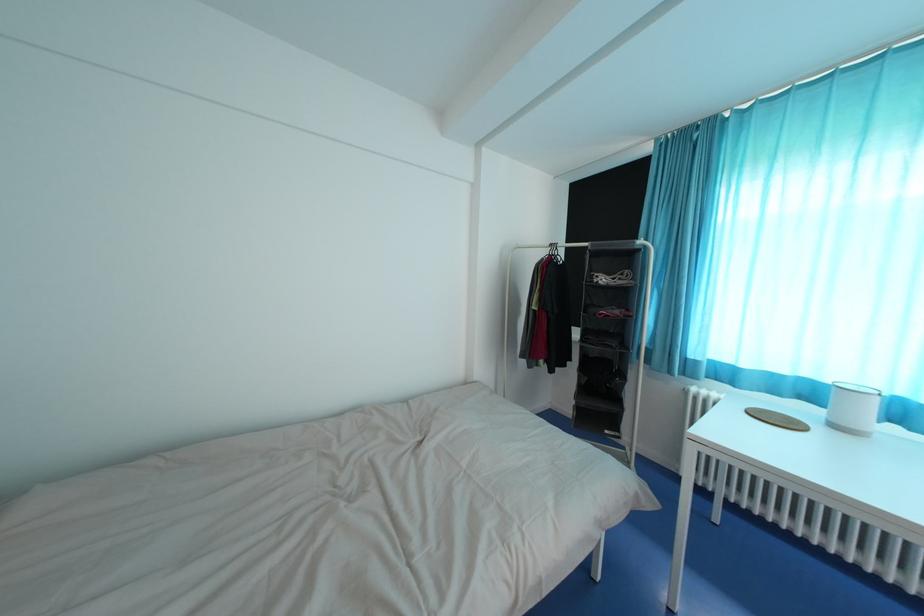
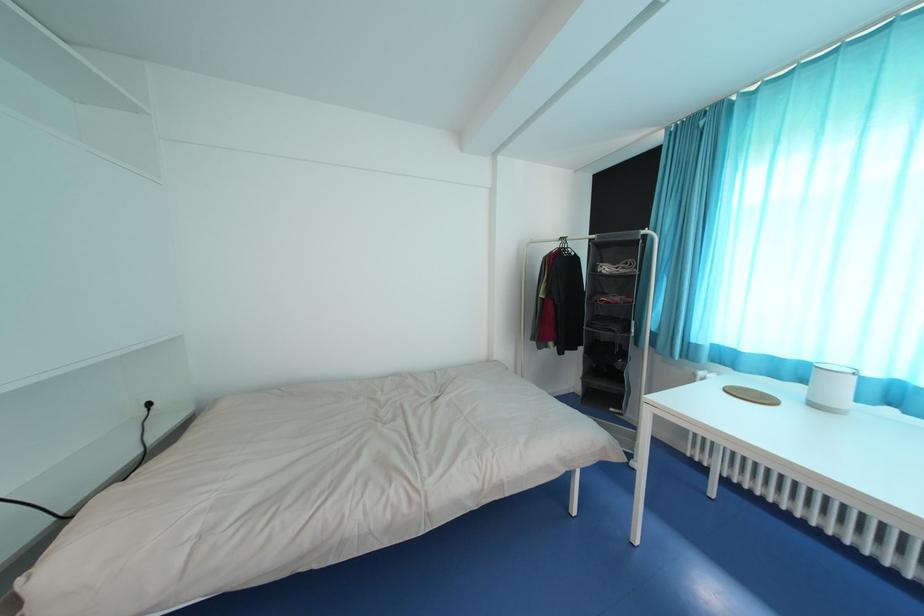
The images are taken continuously from a first-person perspective. In which direction are you moving?

The cameraman walked toward right, backward.